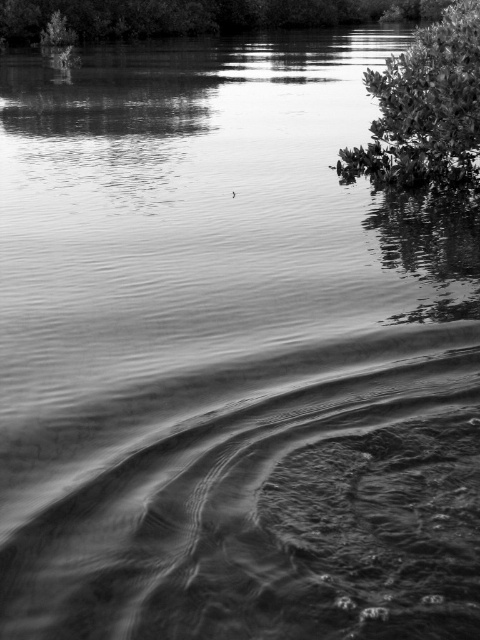
Can you confirm if green leafy tree at upper right is bigger than smooth green foliage at upper center?

No.

Does point (386, 182) come in front of point (249, 8)?

Yes, it is.

The image size is (480, 640). What do you see at coordinates (425, 109) in the screenshot? I see `green leafy tree at upper right` at bounding box center [425, 109].

Identify the location of green leafy tree at upper right. (425, 109).